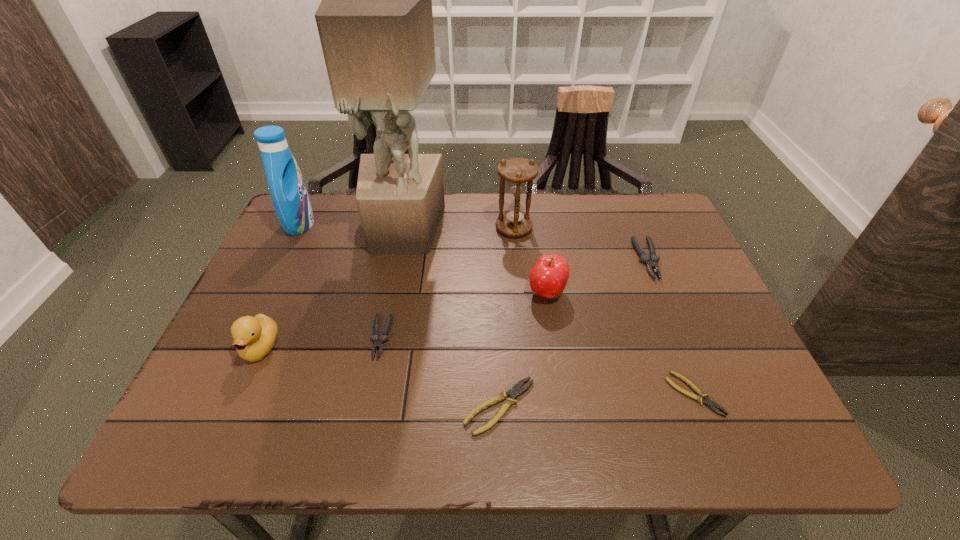
Locate an element on the screen. sculpture is located at coordinates (375, 22).

This screenshot has width=960, height=540. I want to click on gray sculpture, so click(375, 22).

Identify the location of the second tallest object. The width and height of the screenshot is (960, 540). (290, 198).

The width and height of the screenshot is (960, 540). Identify the location of hourglass. pos(519,173).

Identify the location of red apple. (548, 278).

Identify the location of duckling. (254, 337).

Image resolution: width=960 pixels, height=540 pixels. Identify the location of the sixth tallest object. (651, 262).

Identify the location of the farthest pliers. (651, 262).

You are a GUI agent. You are given a task and a screenshot of the screen. Output one action in this format:
    pyautogui.click(x=<x>, y=<y>)
    Task: Click on the third shortest pliers
    This screenshot has height=540, width=960.
    Given the screenshot: What is the action you would take?
    pyautogui.click(x=378, y=343)

In order to click on the nearer gray pliers in this screenshot , I will do `click(378, 343)`.